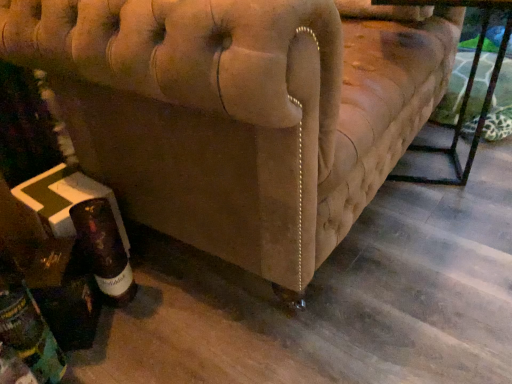
Where is `vacant space underneath metallic black table at lower right (from a real-world perspective)`? The width and height of the screenshot is (512, 384). vacant space underneath metallic black table at lower right (from a real-world perspective) is located at coordinates (436, 165).